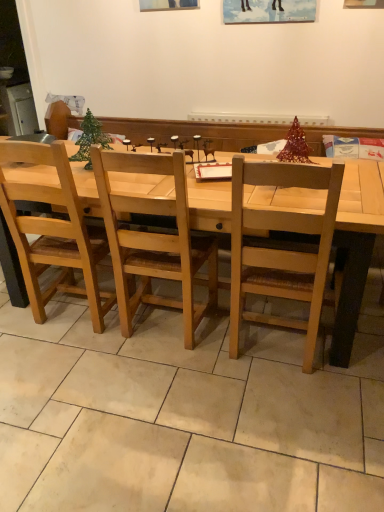
You are a GUI agent. You are given a task and a screenshot of the screen. Output one action in this format:
    pyautogui.click(x=<x>, y=<y>)
    Task: Click on the vacant area that lies in front of light wood chair at center, the 2th chair viewed from the left
    The height and width of the screenshot is (512, 384).
    Given the screenshot: What is the action you would take?
    pyautogui.click(x=285, y=407)